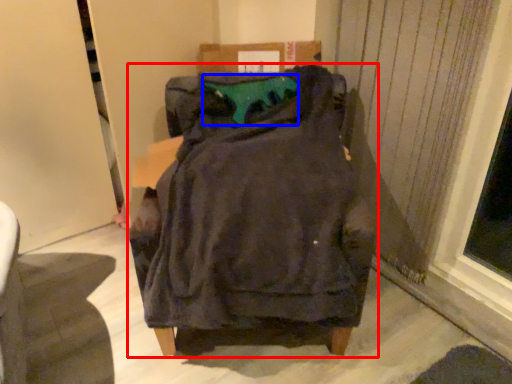
Question: Among these objects, which one is farthest to the camera, furniture (highlighted by a red box) or teal (highlighted by a blue box)?

Choices:
 (A) furniture
 (B) teal

Answer: (B)